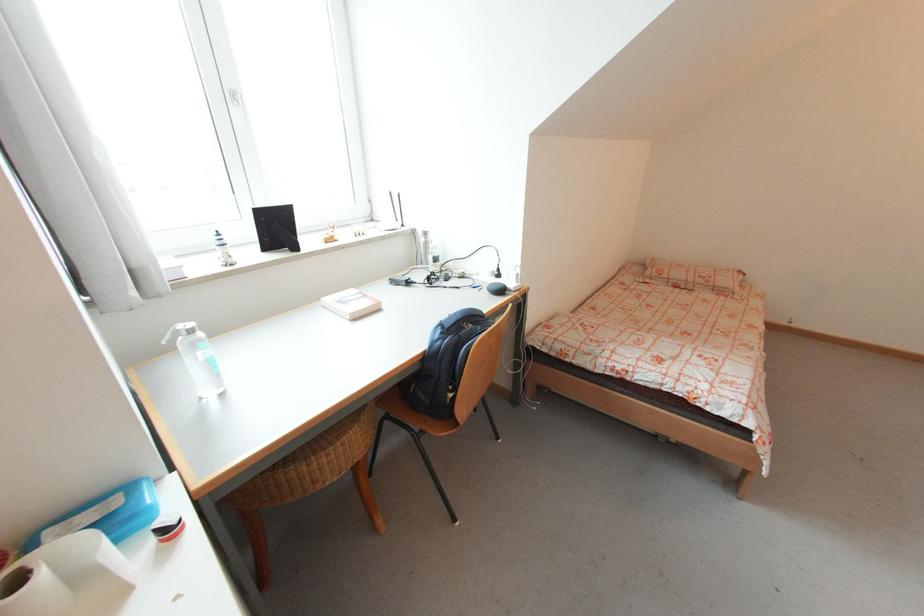
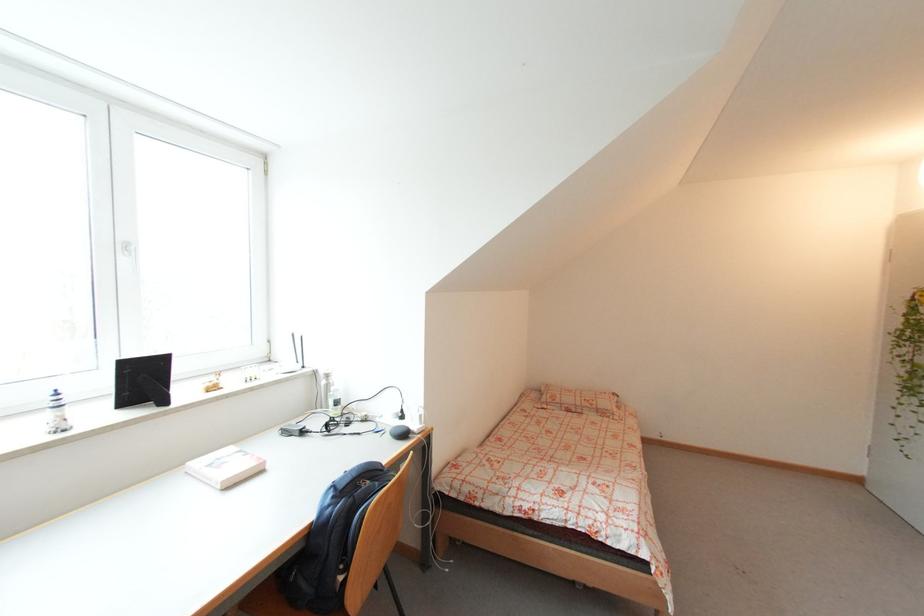
The first image is from the beginning of the video and the second image is from the end. How did the camera likely rotate when shooting the video?

The camera rotated toward right-up.